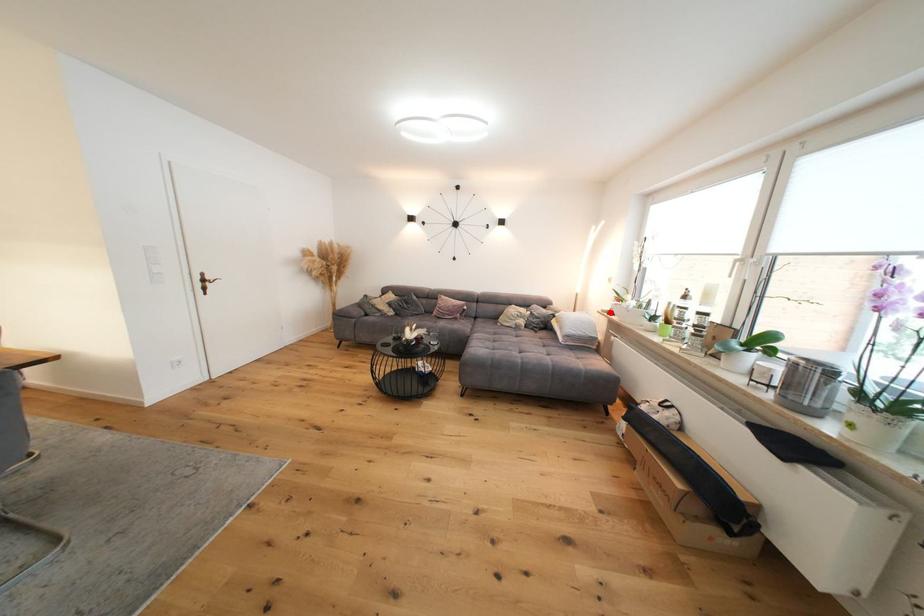
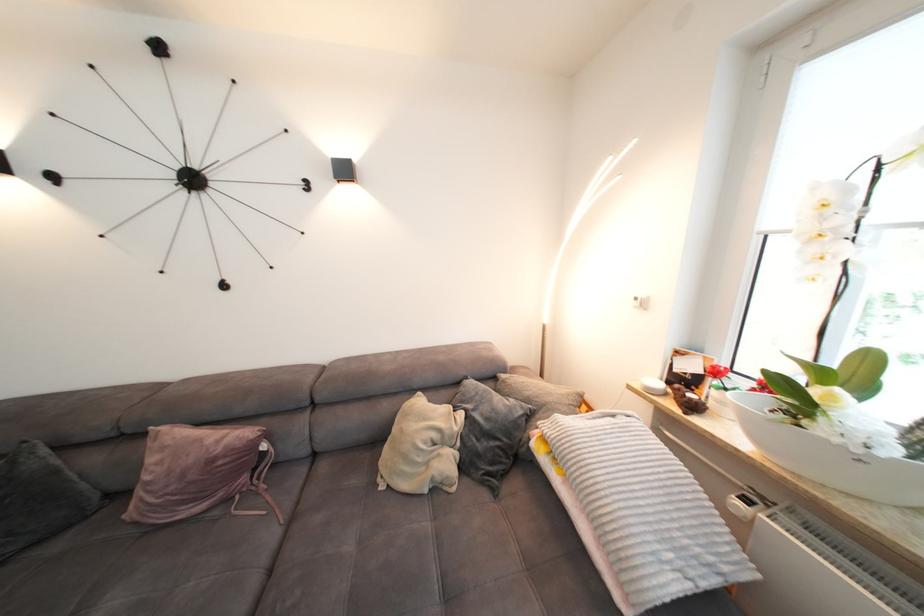
Find the pixel in the second image that matches the highlighted location in the first image.

(657, 391)